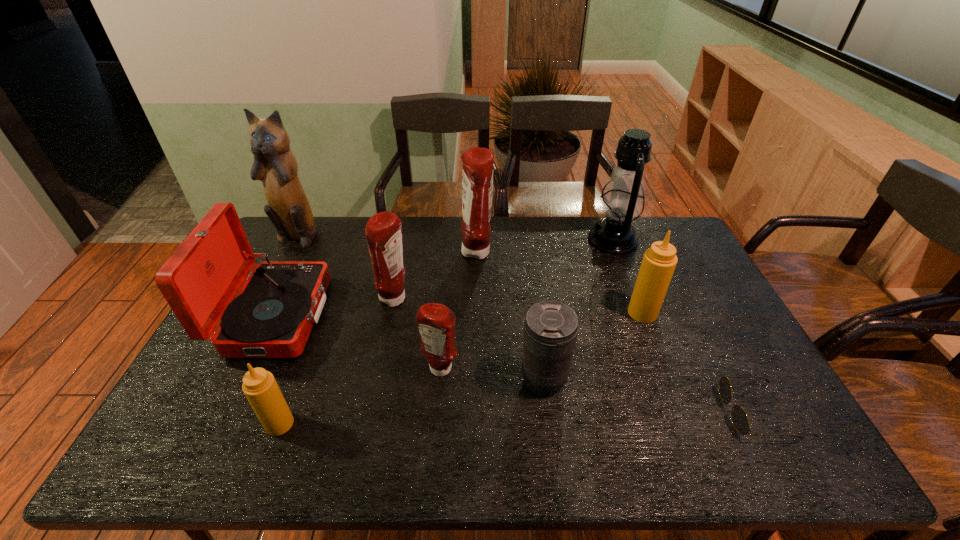
Find the location of a particular element. Image resolution: width=960 pixels, height=540 pixels. free space located on the left of the seventh object from right to left is located at coordinates (328, 300).

You are a GUI agent. You are given a task and a screenshot of the screen. Output one action in this format:
    pyautogui.click(x=<x>, y=<y>)
    Task: Click on the vacant region located 0.070m on the back of the rightmost condiment
    
    Given the screenshot: What is the action you would take?
    pyautogui.click(x=633, y=288)

The image size is (960, 540). What are the coordinates of `vacant space located 0.220m on the side of the telephoto lens where the control switches are located` in the screenshot? It's located at (435, 380).

The width and height of the screenshot is (960, 540). Identify the location of blank space located 0.150m on the side of the telephoto lens where the control switches are located. (462, 380).

What are the coordinates of `blank area located 0.340m on the side of the telephoto lens where the control switches are located` in the screenshot? It's located at (389, 380).

Where is `vacant region located 0.180m on the front of the second nearest condiment`? The image size is (960, 540). vacant region located 0.180m on the front of the second nearest condiment is located at coordinates (434, 446).

Where is `vacant space situated 0.210m on the back of the smaller tan condiment`? The height and width of the screenshot is (540, 960). vacant space situated 0.210m on the back of the smaller tan condiment is located at coordinates (309, 345).

Where is `vacant space located on the lenses of the shortest object`? Image resolution: width=960 pixels, height=540 pixels. vacant space located on the lenses of the shortest object is located at coordinates (586, 413).

Where is `vacant area situated 0.270m on the lenses of the shortest object`? This screenshot has height=540, width=960. vacant area situated 0.270m on the lenses of the shortest object is located at coordinates (614, 413).

This screenshot has width=960, height=540. Find the location of `vacant point located on the lenses of the shortest object`. vacant point located on the lenses of the shortest object is located at coordinates (651, 413).